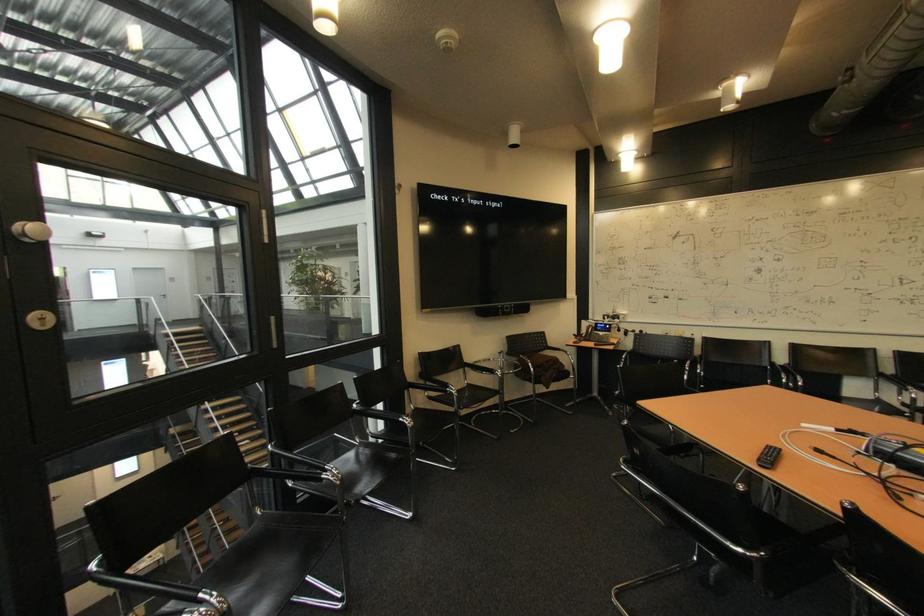
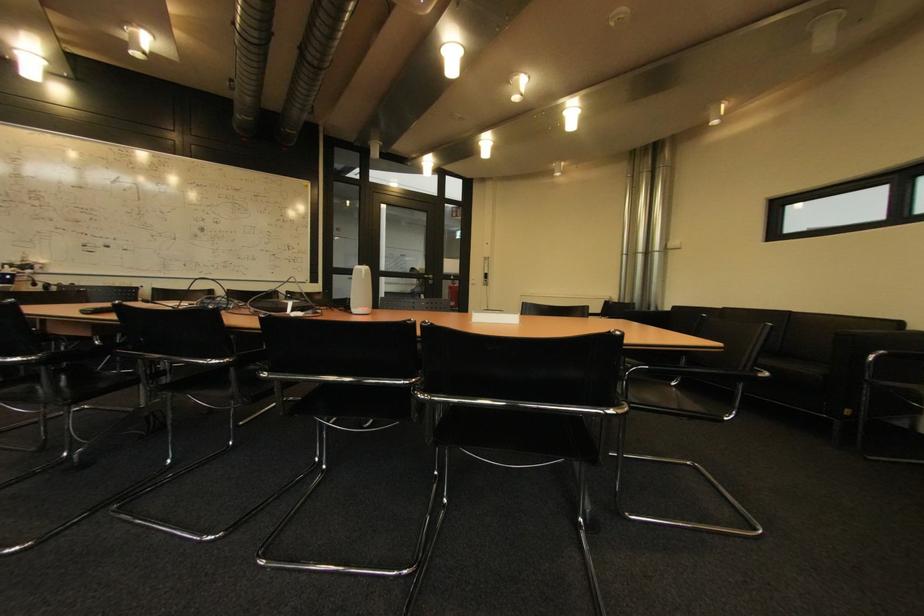
Question: The images are taken continuously from a first-person perspective. In which direction is your viewpoint rotating?

Choices:
 (A) Left
 (B) Right
 (C) Up
 (D) Down

Answer: (B)